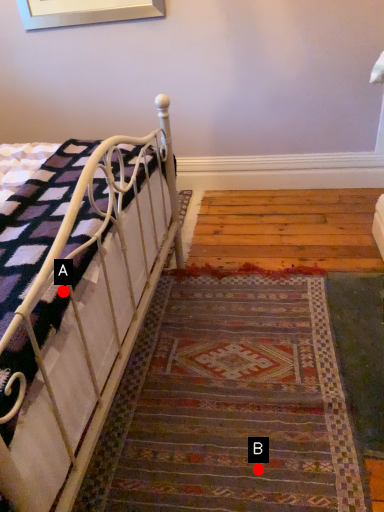
Question: Two points are circled on the image, labeled by A and B beside each circle. Which point is closer to the camera?

Choices:
 (A) A is closer
 (B) B is closer

Answer: (A)